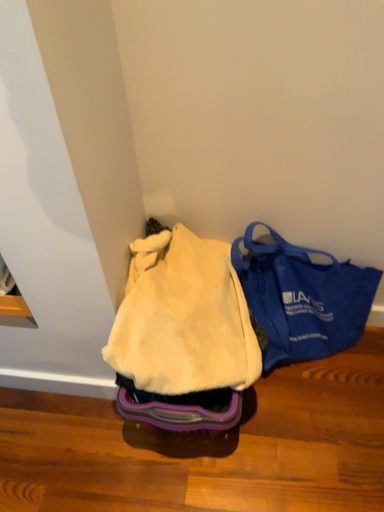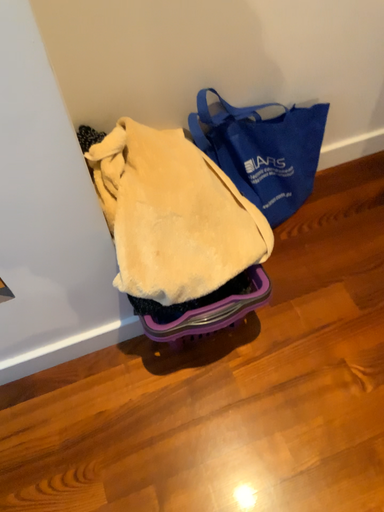
Question: How did the camera likely rotate when shooting the video?

Choices:
 (A) rotated right
 (B) rotated left

Answer: (A)